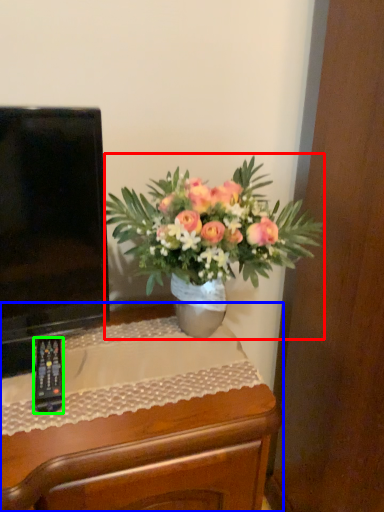
Question: Which object is positioned farthest from houseplant (highlighted by a red box)? Select from desk (highlighted by a blue box) and remote control (highlighted by a green box).

Choices:
 (A) desk
 (B) remote control

Answer: (B)